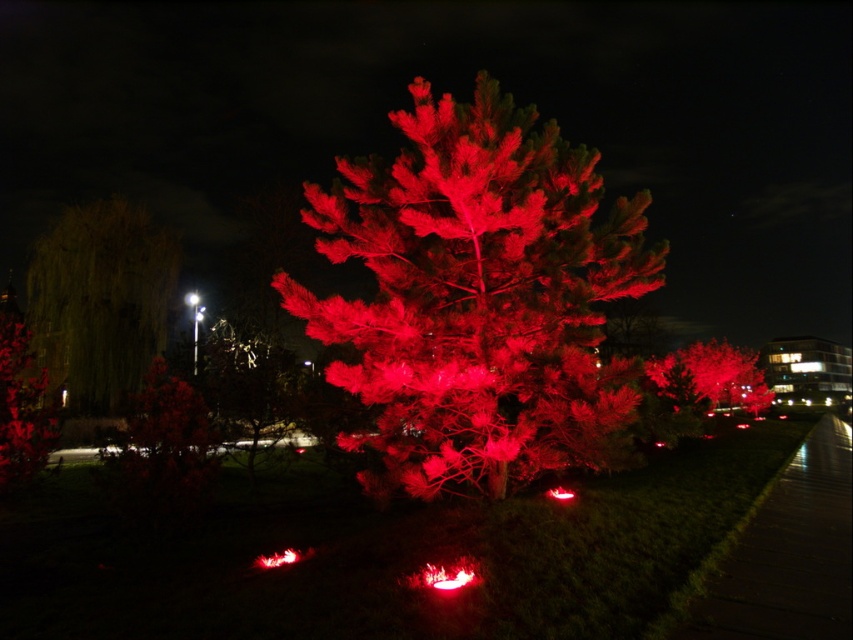
Question: Which object is farther from the camera taking this photo?

Choices:
 (A) glossy red tree at left
 (B) shiny metallic sculpture at center
 (C) smooth bark willow at left
 (D) red illuminated pine tree at center

Answer: (C)

Question: Which point is closer to the camera taking this photo?

Choices:
 (A) (9, 378)
 (B) (207, 364)

Answer: (A)

Question: Can you confirm if shiny metallic sculpture at center is positioned below glossy red tree at left?

Choices:
 (A) yes
 (B) no

Answer: (A)

Question: Can you confirm if red illuminated pine tree at center is positioned to the left of shiny metallic sculpture at center?

Choices:
 (A) no
 (B) yes

Answer: (A)

Question: In this image, where is red illuminated pine tree at center located relative to shiny metallic sculpture at center?

Choices:
 (A) below
 (B) above

Answer: (B)

Question: Which point appears farthest from the camera in this image?

Choices:
 (A) (585, 321)
 (B) (35, 289)
 (C) (270, 410)
 (D) (16, 385)

Answer: (B)